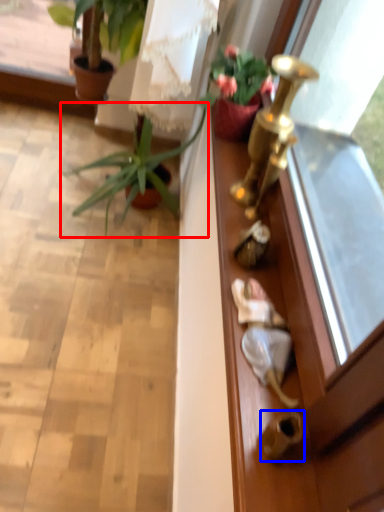
Question: Among these objects, which one is farthest to the camera, houseplant (highlighted by a red box) or door handle (highlighted by a blue box)?

Choices:
 (A) houseplant
 (B) door handle

Answer: (A)